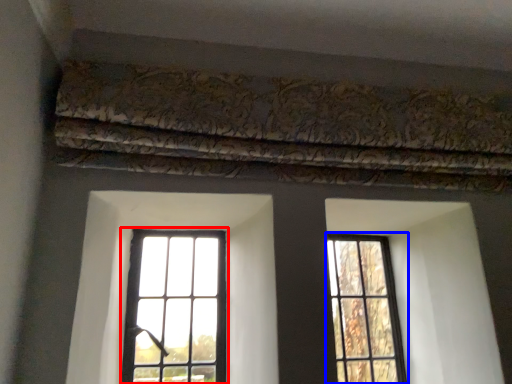
Question: Which point is further to the camera, window (highlighted by a red box) or window (highlighted by a blue box)?

Choices:
 (A) window
 (B) window

Answer: (B)